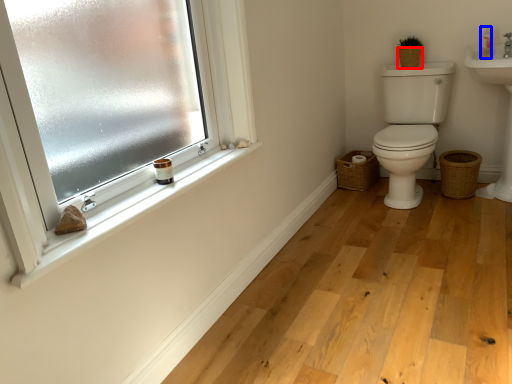
Question: Which of the following is the closest to the observer, basket (highlighted by a red box) or toiletry (highlighted by a blue box)?

Choices:
 (A) basket
 (B) toiletry

Answer: (B)